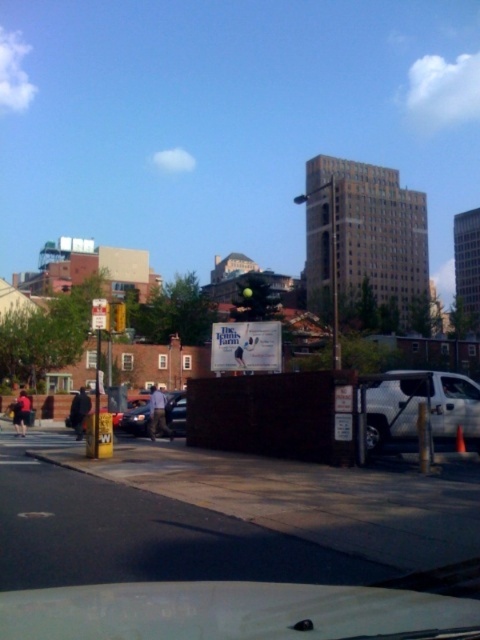
What are the coordinates of the white matte truck at right in the image?

The white matte truck at right is located at coordinates point (418,404).

You are sitting in the front passenger seat of a car and notice two points marked on the road ahead. The first point is at coordinates point [157,417] and the second is at point [84,412]. Which point is closer to your current position?

Point [157,417] is closer to the camera than point [84,412], so the first point is closer to your current position.

You are driving a car and want to safely pass the white matte truck at right. Considering the road conditions and your vehicle size, is there enough space to overtake the truck without encroaching on the opposite lane?

The distance between you and the white matte truck at right is 11.24 meters. Based on typical vehicle lengths and safe overtaking distances, this distance may be sufficient to pass safely if the road ahead is clear of oncoming traffic and the truck is moving at a consistent speed. However, always ensure there is enough space to return to your lane before any oncoming vehicles arrive.